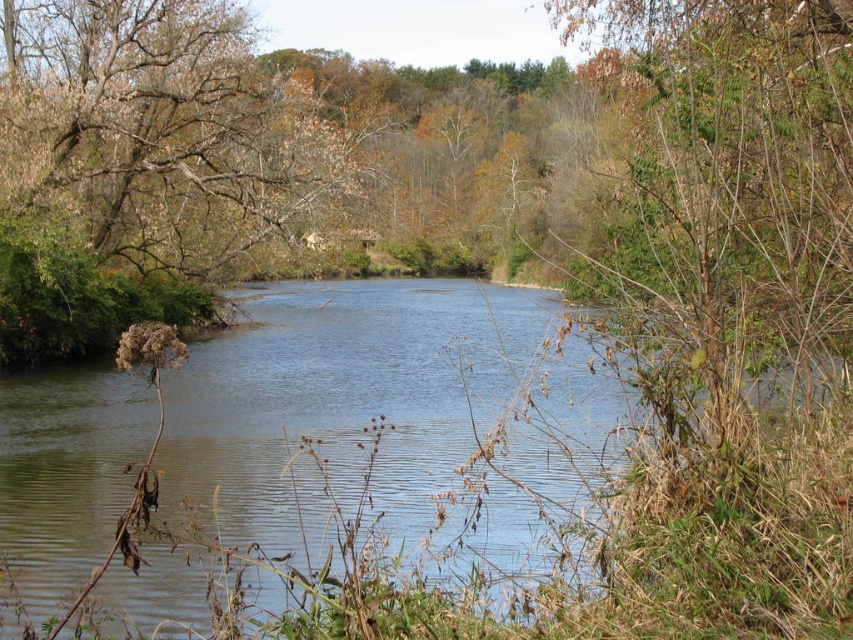
Question: Is the position of clear water at center less distant than that of brown leafy tree at upper left?

Choices:
 (A) no
 (B) yes

Answer: (B)

Question: Can you confirm if clear water at center is positioned below brown leafy tree at upper left?

Choices:
 (A) no
 (B) yes

Answer: (B)

Question: Which point is farther from the camera taking this photo?

Choices:
 (A) (639, 577)
 (B) (207, 173)

Answer: (B)

Question: Is clear water at center positioned behind brown leafy tree at upper left?

Choices:
 (A) no
 (B) yes

Answer: (A)

Question: Among these objects, which one is nearest to the camera?

Choices:
 (A) clear water at center
 (B) brown leafy tree at upper left

Answer: (A)

Question: Among these objects, which one is farthest from the camera?

Choices:
 (A) clear water at center
 (B) brown leafy tree at upper left

Answer: (B)